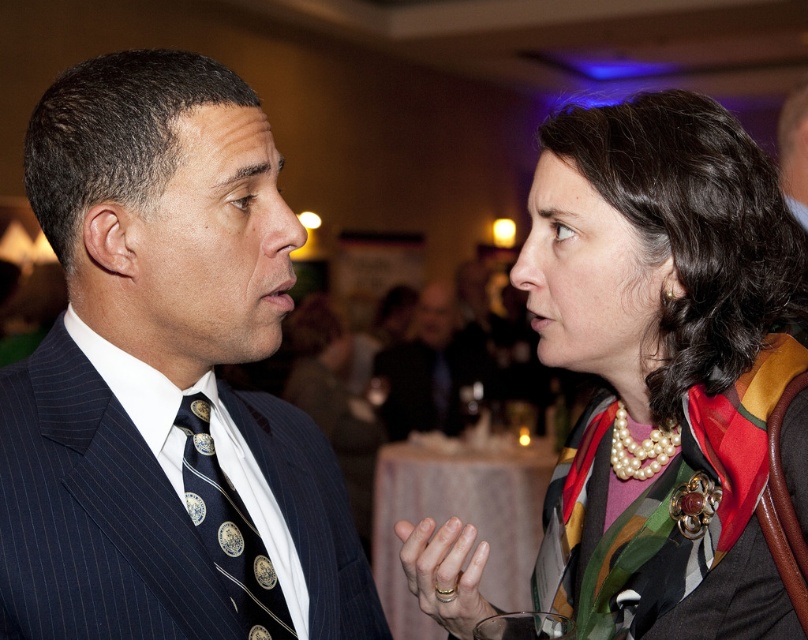
In the scene shown: Does pearl necklace at upper right have a greater height compared to navy silk tie at center?

Yes.

From the picture: Who is more distant from viewer, (x=672, y=301) or (x=236, y=577)?

The point (x=672, y=301) is more distant.

Where is `pearl necklace at upper right`? Image resolution: width=808 pixels, height=640 pixels. pearl necklace at upper right is located at coordinates (661, 365).

Does dark blue pinstripe suit at center have a greater height compared to dark suit at center?

No, dark blue pinstripe suit at center is not taller than dark suit at center.

Which is behind, point (9, 563) or point (442, 332)?

The point (442, 332) is more distant.

Where is `dark blue pinstripe suit at center`? The height and width of the screenshot is (640, 808). dark blue pinstripe suit at center is located at coordinates (166, 380).

Is pearl necklace at upper right bigger than dark suit at center?

No.

Is pearl necklace at upper right shorter than dark suit at center?

Yes.

Describe the element at coordinates (661, 365) in the screenshot. I see `pearl necklace at upper right` at that location.

The height and width of the screenshot is (640, 808). In order to click on pearl necklace at upper right in this screenshot , I will do `click(661, 365)`.